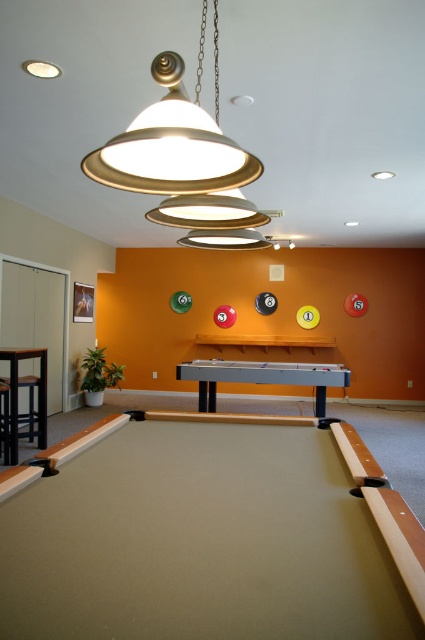
Which of these two, beige felt pool table at center or smooth gray pool table at center, stands taller?

With more height is smooth gray pool table at center.

Is point (207, 467) behind point (345, 376)?

No, it is not.

What are the coordinates of `beige felt pool table at center` in the screenshot? It's located at (207, 536).

The image size is (425, 640). Identify the location of beige felt pool table at center. (207, 536).

Can you confirm if smooth gray pool table at center is shorter than black leather stool at lower left?

Correct, smooth gray pool table at center is not as tall as black leather stool at lower left.

Is smooth gray pool table at center smaller than black leather stool at lower left?

Incorrect, smooth gray pool table at center is not smaller in size than black leather stool at lower left.

The image size is (425, 640). Describe the element at coordinates (261, 378) in the screenshot. I see `smooth gray pool table at center` at that location.

Where is `smooth gray pool table at center`? The width and height of the screenshot is (425, 640). smooth gray pool table at center is located at coordinates (261, 378).

Is beige felt pool table at center positioned behind black leather stool at lower left?

That is False.

Does point (62, 602) come closer to viewer compared to point (16, 406)?

Yes.

I want to click on beige felt pool table at center, so pyautogui.click(x=207, y=536).